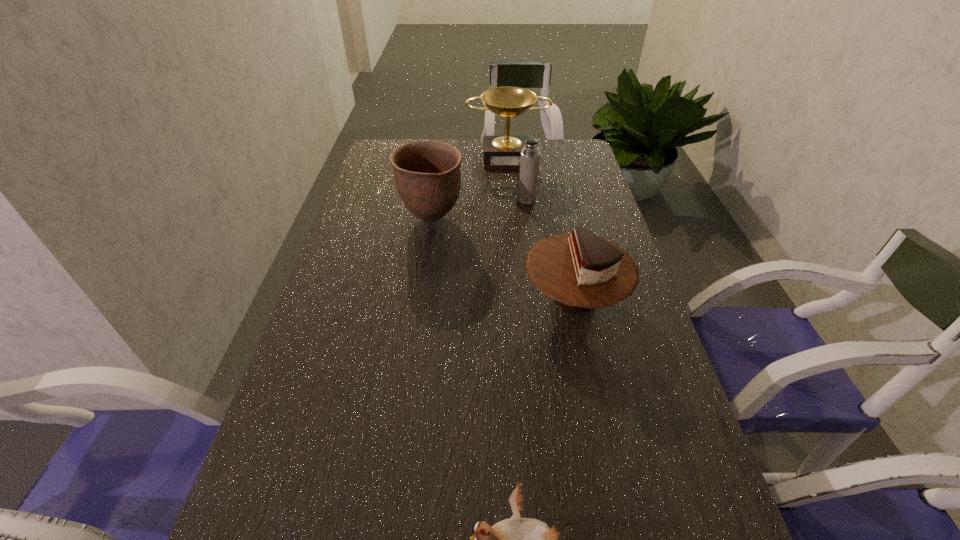
The height and width of the screenshot is (540, 960). What are the coordinates of `award that is at the right edge` in the screenshot? It's located at (500, 152).

The height and width of the screenshot is (540, 960). What are the coordinates of `cake positioned at the right edge` in the screenshot? It's located at (580, 271).

Where is `object located in the far right corner section of the desktop`? object located in the far right corner section of the desktop is located at coordinates (500, 152).

I want to click on blank space at the far edge of the desktop, so click(472, 143).

In the image, there is a desktop. Identify the location of free region at the left edge. The image size is (960, 540). (389, 250).

The width and height of the screenshot is (960, 540). In the image, there is a desktop. Identify the location of vacant region at the right edge. (562, 233).

Image resolution: width=960 pixels, height=540 pixels. Find the location of `free spot at the far right corner of the desktop`. free spot at the far right corner of the desktop is located at coordinates (550, 161).

This screenshot has height=540, width=960. In order to click on unoccupied area between the thermos bottle and the farthest object in this screenshot , I will do `click(516, 178)`.

The height and width of the screenshot is (540, 960). What are the coordinates of `empty space that is in between the thermos bottle and the pottery` in the screenshot? It's located at (479, 209).

I want to click on vacant space in between the pottery and the fourth farthest object, so click(503, 258).